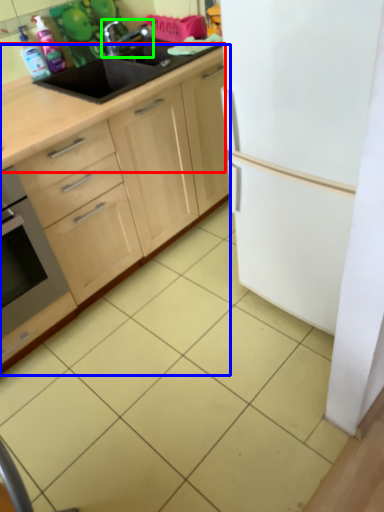
Question: Based on their relative distances, which object is farther from countertop (highlighted by a red box)? Choose from cabinetry (highlighted by a blue box) and tap (highlighted by a green box).

Choices:
 (A) cabinetry
 (B) tap

Answer: (B)